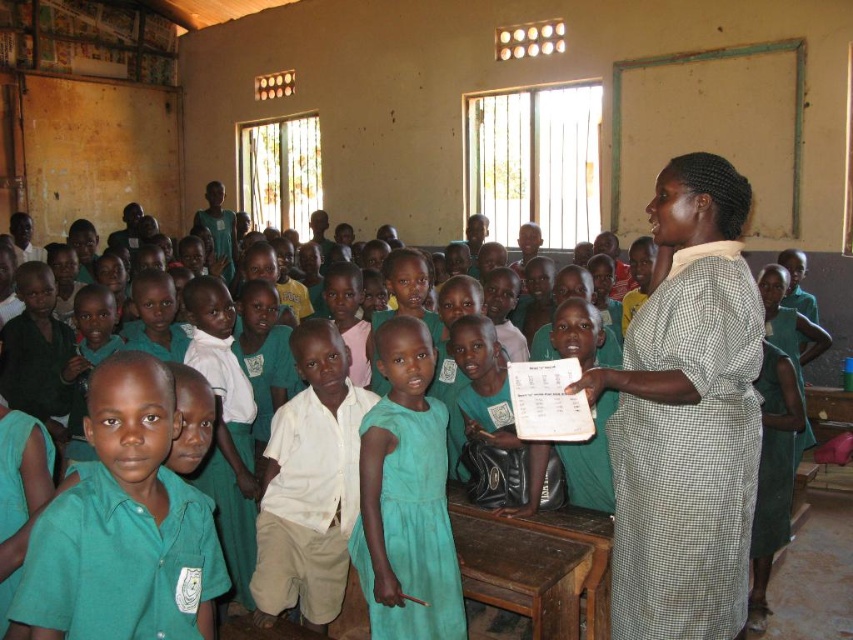
Question: Observing the image, what is the correct spatial positioning of checkered fabric dress at right in reference to teal fabric dress at center?

Choices:
 (A) left
 (B) right

Answer: (B)

Question: Which object is closer to the camera taking this photo?

Choices:
 (A) teal fabric dress at center
 (B) checkered fabric dress at right

Answer: (B)

Question: Is checkered fabric dress at right above teal fabric dress at center?

Choices:
 (A) yes
 (B) no

Answer: (A)

Question: Which point is farther from the camera taking this photo?

Choices:
 (A) (366, 557)
 (B) (741, 406)

Answer: (A)

Question: Does checkered fabric dress at right appear on the left side of teal fabric dress at center?

Choices:
 (A) no
 (B) yes

Answer: (A)